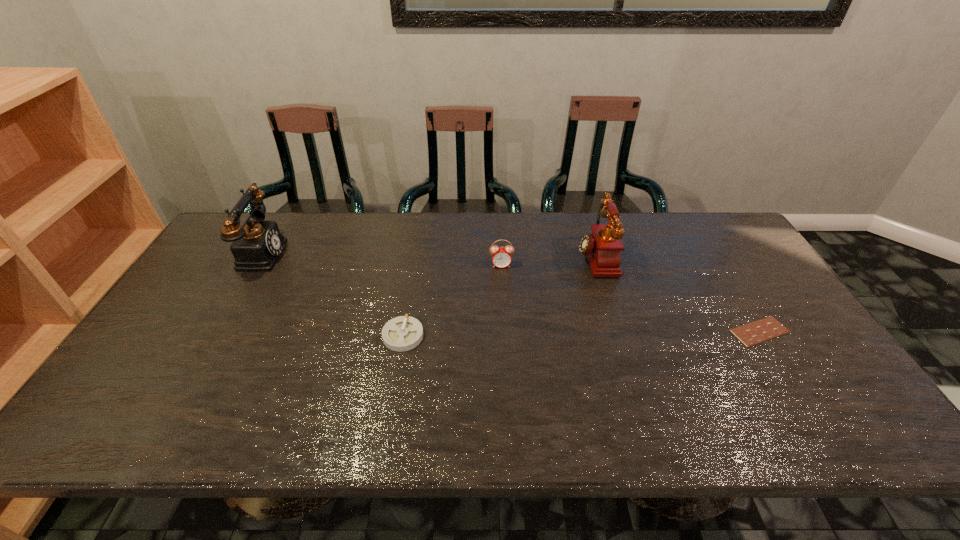
Find the location of a particular element. vacant space situated 0.260m on the dial of the second object from right to left is located at coordinates (494, 256).

Image resolution: width=960 pixels, height=540 pixels. What are the coordinates of `free space located on the dial of the second object from right to left` in the screenshot? It's located at (536, 256).

The image size is (960, 540). What are the coordinates of `vacant area situated 0.080m on the clock face of the third tallest object` in the screenshot? It's located at (502, 287).

This screenshot has height=540, width=960. I want to click on free space located on the front of the ashtray, so click(x=396, y=378).

The image size is (960, 540). Identify the location of free space located on the left of the chocolate bar. (579, 332).

Identify the location of object present at the left edge. This screenshot has width=960, height=540. (256, 246).

Where is `object that is positioned at the right edge`? The height and width of the screenshot is (540, 960). object that is positioned at the right edge is located at coordinates (750, 334).

This screenshot has height=540, width=960. Find the location of `object at the far left corner`. object at the far left corner is located at coordinates (256, 246).

The image size is (960, 540). In the image, there is a desktop. What are the coordinates of `free space at the far edge` in the screenshot? It's located at (320, 215).

Identify the location of blank area at the near edge. (473, 408).